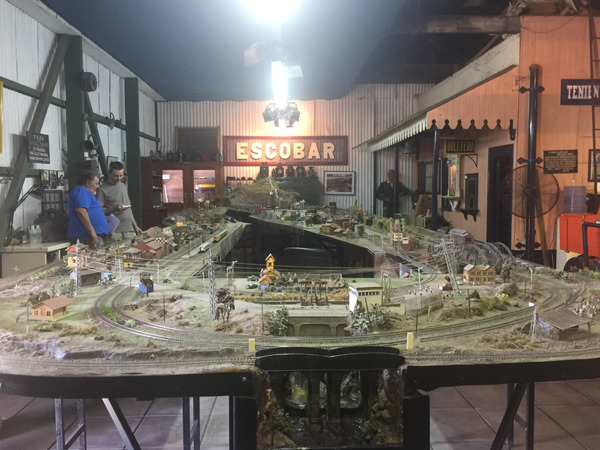
You are a GUI agent. You are given a task and a screenshot of the screen. Output one action in this format:
    pyautogui.click(x=<x>, y=<y>)
    Task: Click on the walls
    
    Given the screenshot: What is the action you would take?
    pyautogui.click(x=353, y=122), pyautogui.click(x=117, y=104), pyautogui.click(x=480, y=163), pyautogui.click(x=558, y=130)